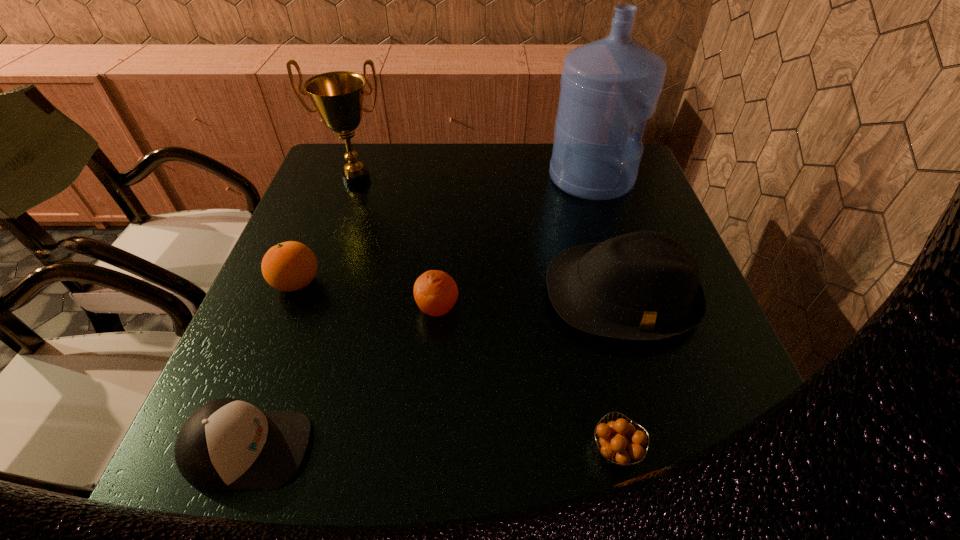
Image resolution: width=960 pixels, height=540 pixels. I want to click on cap that is at the left edge, so click(x=227, y=444).

This screenshot has height=540, width=960. Find the location of `water jug positioned at the right edge`. water jug positioned at the right edge is located at coordinates (607, 86).

Identify the location of fedora that is positioned at the right edge. The image size is (960, 540). (643, 286).

The width and height of the screenshot is (960, 540). Find the location of `object at the far left corner`. object at the far left corner is located at coordinates (338, 96).

This screenshot has width=960, height=540. Find the location of `object that is positioned at the near left corner`. object that is positioned at the near left corner is located at coordinates [x=227, y=444].

You are a GUI agent. You are given a task and a screenshot of the screen. Output one action in this format:
    pyautogui.click(x=<x>, y=<y>)
    Task: Click on the object that is positioned at the far right corner
    Image resolution: width=960 pixels, height=540 pixels.
    Given the screenshot: What is the action you would take?
    pyautogui.click(x=607, y=86)

In the image, there is a desktop. Identify the location of free space at the far edge. This screenshot has height=540, width=960. (438, 162).

The width and height of the screenshot is (960, 540). I want to click on vacant space at the near edge, so click(x=333, y=457).

Locate an element on the screen. The image size is (960, 540). free point at the left edge is located at coordinates (235, 395).

Identify the location of vacant space that's between the fourth object from right to left and the sixth shortest object. The image size is (960, 540). (397, 244).